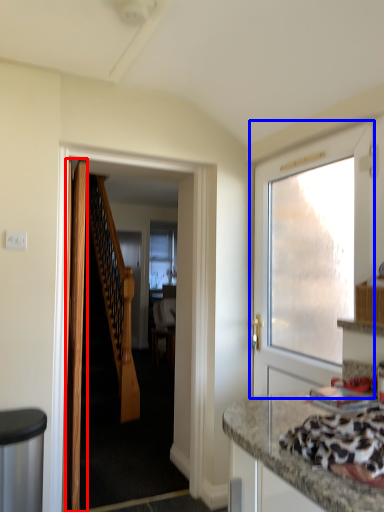
Question: Among these objects, which one is nearest to the camera, door (highlighted by a red box) or door (highlighted by a blue box)?

Choices:
 (A) door
 (B) door

Answer: (B)